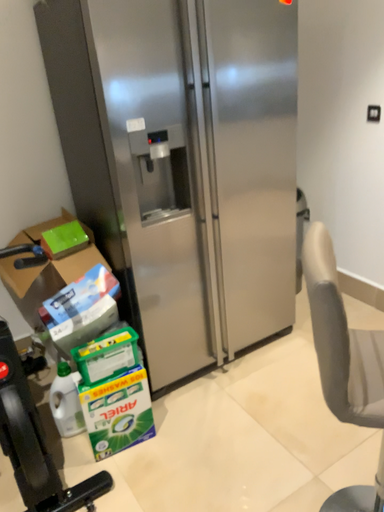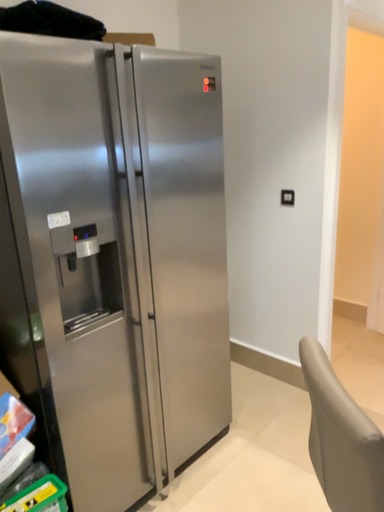
Question: How did the camera likely rotate when shooting the video?

Choices:
 (A) rotated right
 (B) rotated left

Answer: (A)